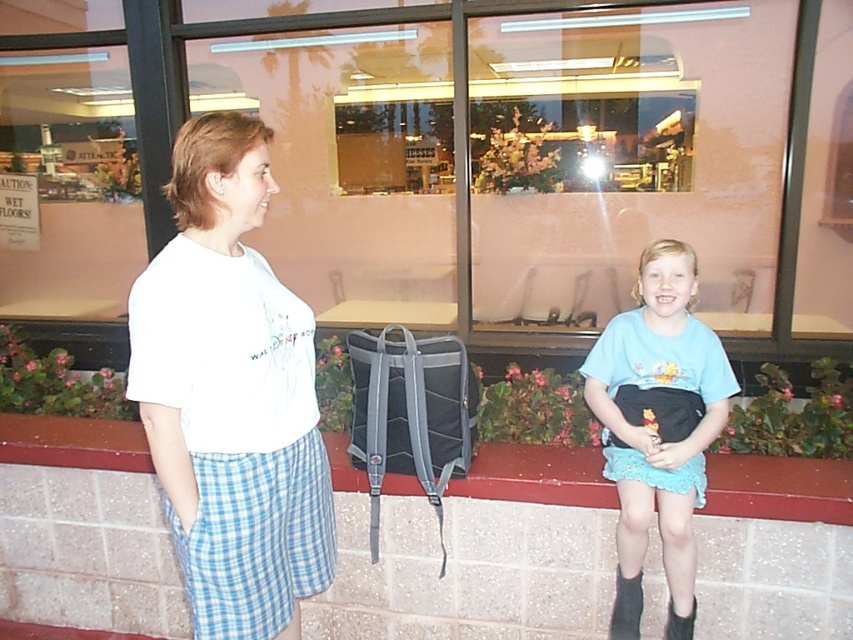
Question: Is white cotton shirt at center further to camera compared to brick ledge at lower center?

Choices:
 (A) yes
 (B) no

Answer: (B)

Question: Which object is positioned closest to the black fabric boot at lower right?

Choices:
 (A) white cotton shirt at center
 (B) brick ledge at lower center
 (C) light blue fabric skirt at lower right

Answer: (B)

Question: Does light blue fabric skirt at lower right appear on the right side of brick ledge at lower center?

Choices:
 (A) yes
 (B) no

Answer: (A)

Question: In this image, where is white cotton shirt at center located relative to light blue fabric skirt at lower right?

Choices:
 (A) left
 (B) right

Answer: (A)

Question: Based on their relative distances, which object is nearer to the black suede boot at lower right?

Choices:
 (A) brick ledge at lower center
 (B) white cotton shirt at center

Answer: (A)

Question: Which of the following is the farthest from the observer?

Choices:
 (A) (608, 637)
 (B) (683, 602)
 (C) (668, 616)

Answer: (A)